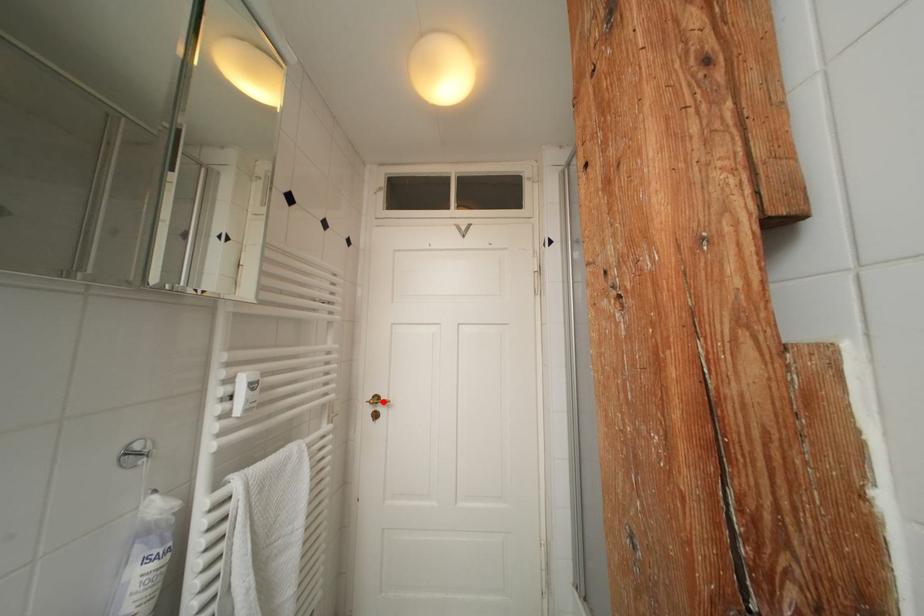
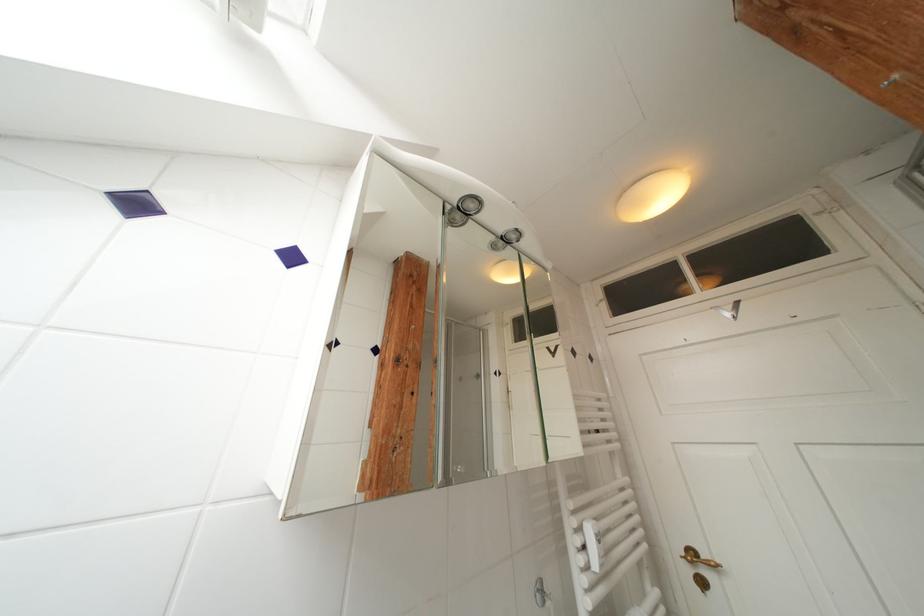
Locate, in the second image, the point that corresponds to the highlighted location in the first image.

(699, 557)